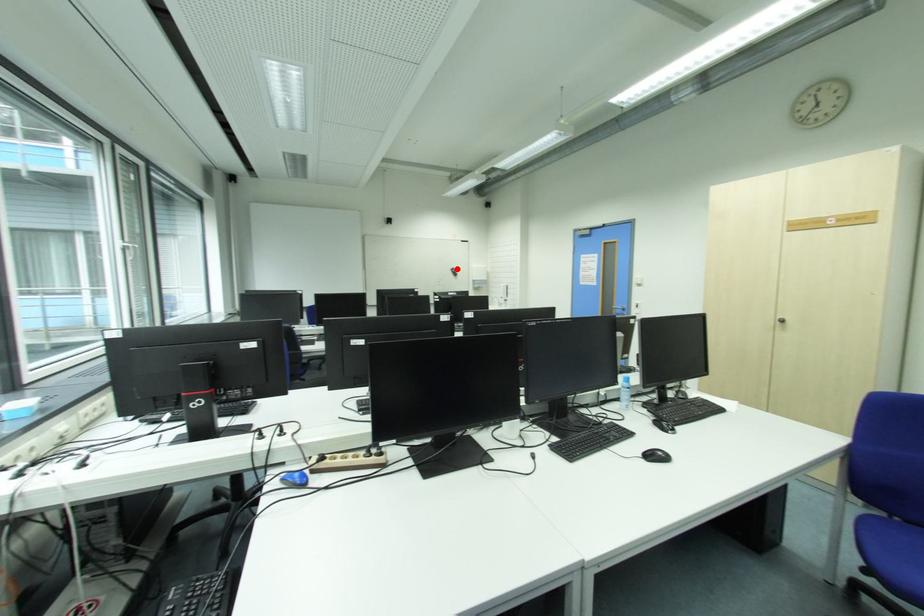
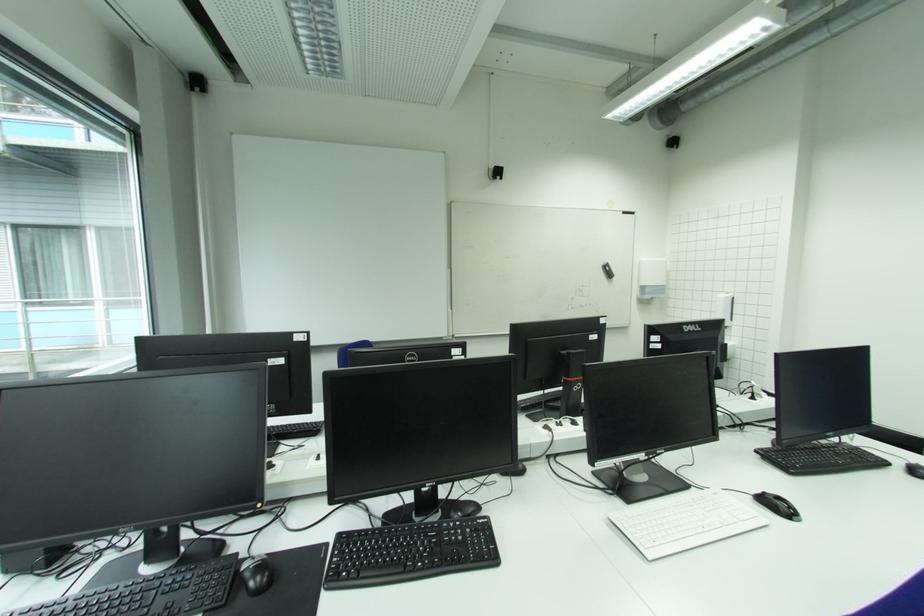
The point at the highlighted location is marked in the first image. Where is the corresponding point in the second image?

(610, 264)